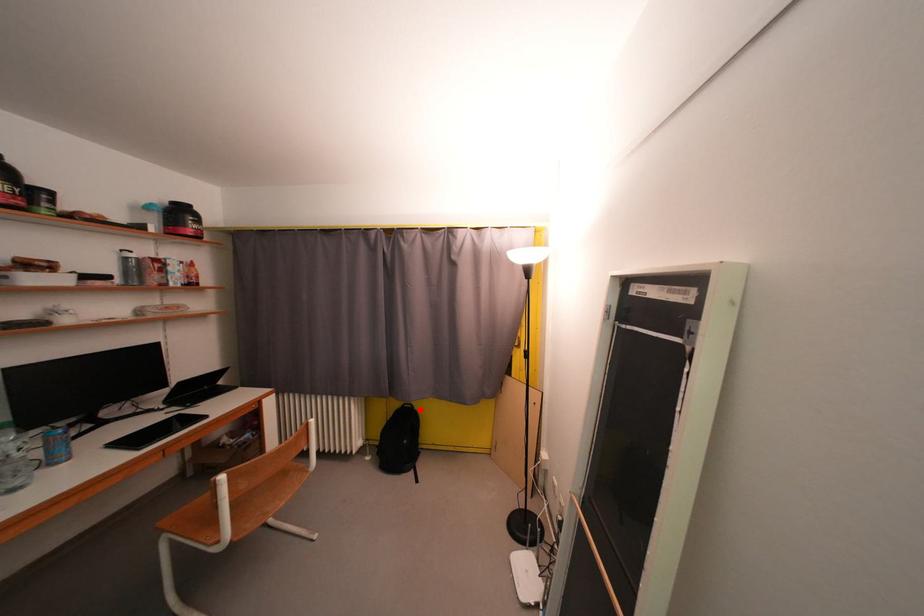
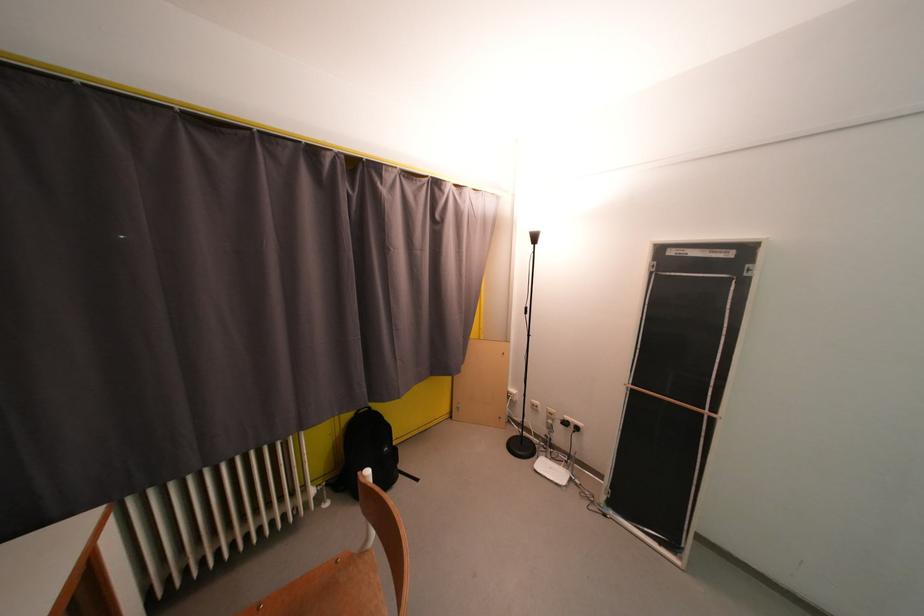
Where in the second image is the point corresponding to the highlighted location from the first image?

(378, 411)